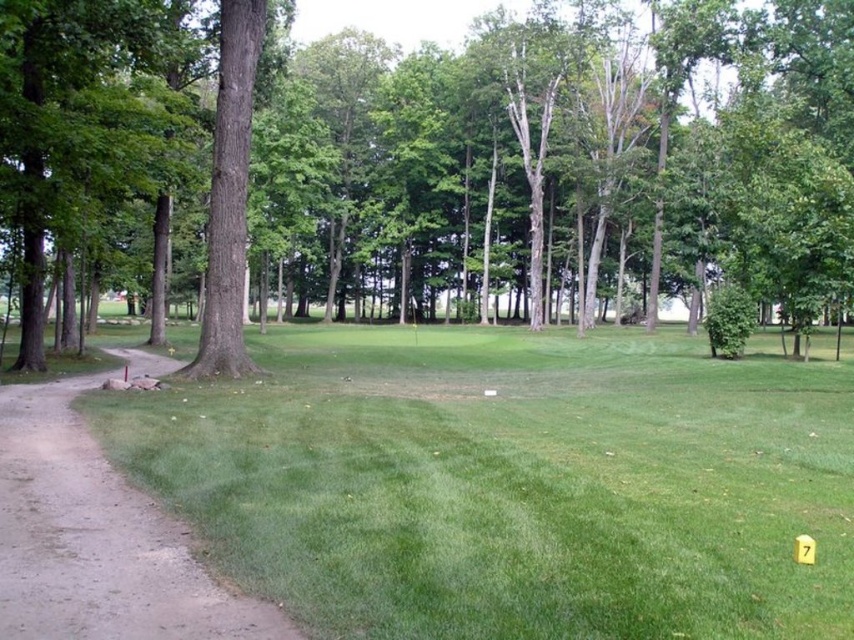
Question: Does green leafy tree at center appear on the left side of green grassy area at lower left?

Choices:
 (A) yes
 (B) no

Answer: (A)

Question: Which point is closer to the camera taking this photo?

Choices:
 (A) (159, 552)
 (B) (525, 636)

Answer: (B)

Question: Which object appears farthest from the camera in this image?

Choices:
 (A) dirt/gravel path at left
 (B) green grassy area at lower left
 (C) green leafy tree at center

Answer: (C)

Question: Which of the following is the closest to the observer?

Choices:
 (A) green grassy area at lower left
 (B) green leafy tree at center

Answer: (A)

Question: Is green leafy tree at center positioned before green grassy area at lower left?

Choices:
 (A) no
 (B) yes

Answer: (A)

Question: Considering the relative positions of green leafy tree at center and green grassy area at lower left in the image provided, where is green leafy tree at center located with respect to green grassy area at lower left?

Choices:
 (A) left
 (B) right

Answer: (A)